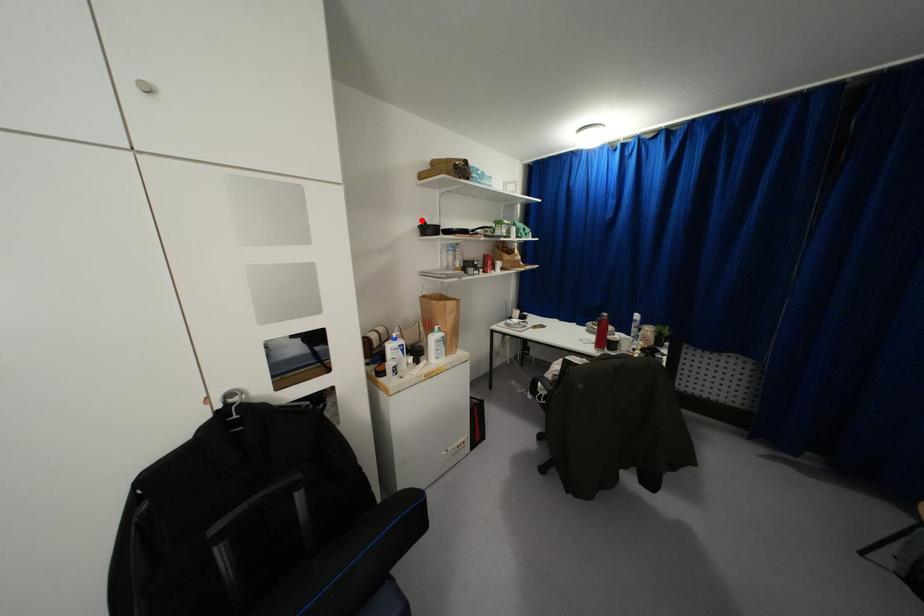
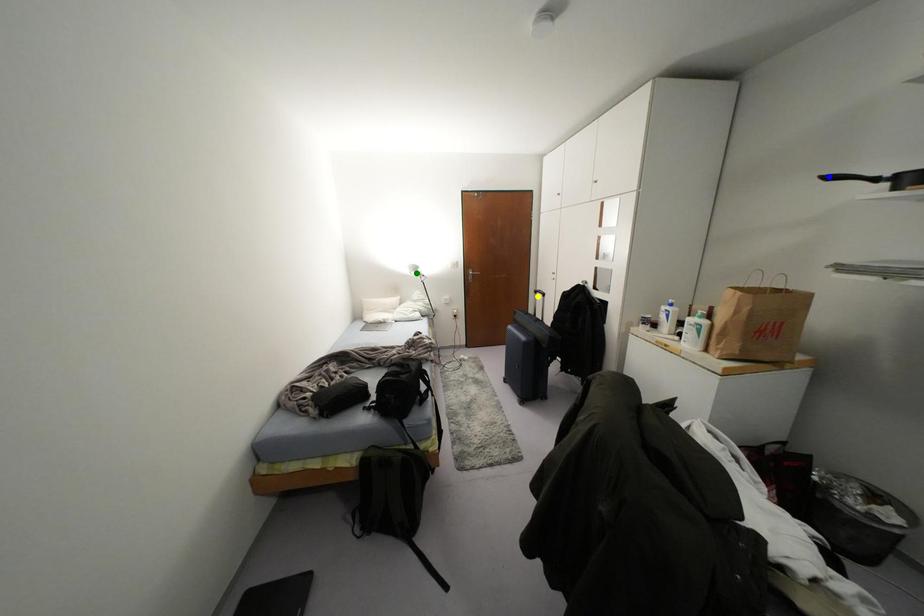
Question: I am providing you with two images of the same scene from different viewpoints. A red point is marked on the first image. You are given multiple points on the second image. Which point in image 2 is actually the same real-world point as the red point in image 1?

Choices:
 (A) yellow point
 (B) green point
 (C) blue point

Answer: (C)